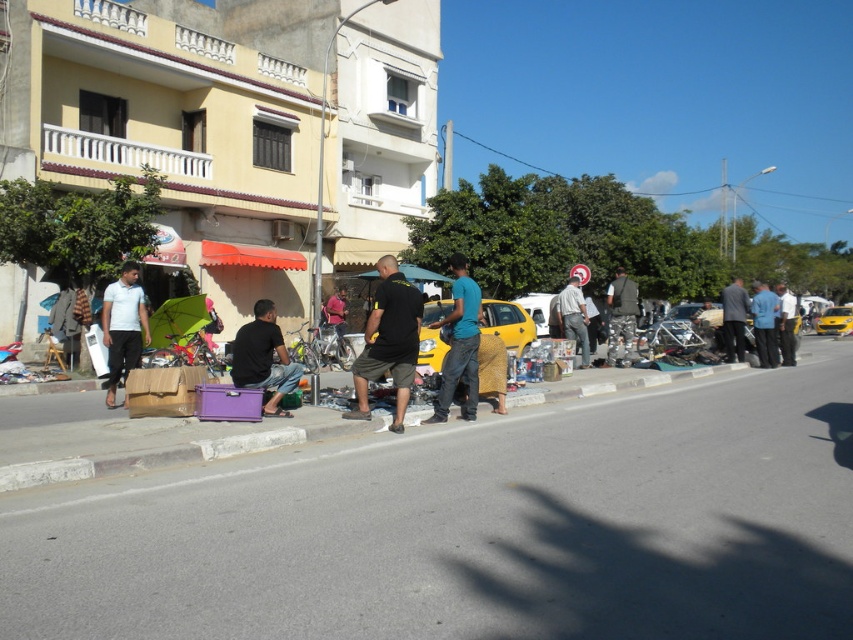
You are a customer looking for a specific item in the market. You see two people wearing black matte shirt at lower left and white matte shirt at left. Which one is positioned more to the right side of the market?

The black matte shirt at lower left is positioned more to the right side of the market than the white matte shirt at left.